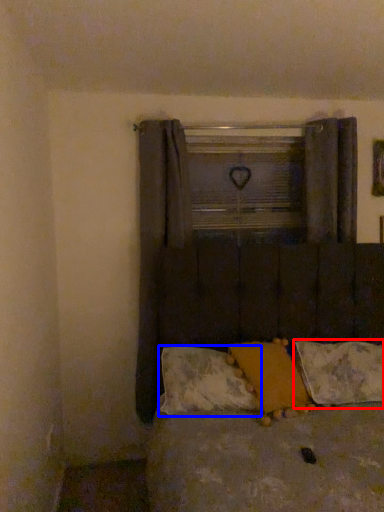
Question: Which object is closer to the camera taking this photo, pillow (highlighted by a red box) or pillow (highlighted by a blue box)?

Choices:
 (A) pillow
 (B) pillow

Answer: (B)